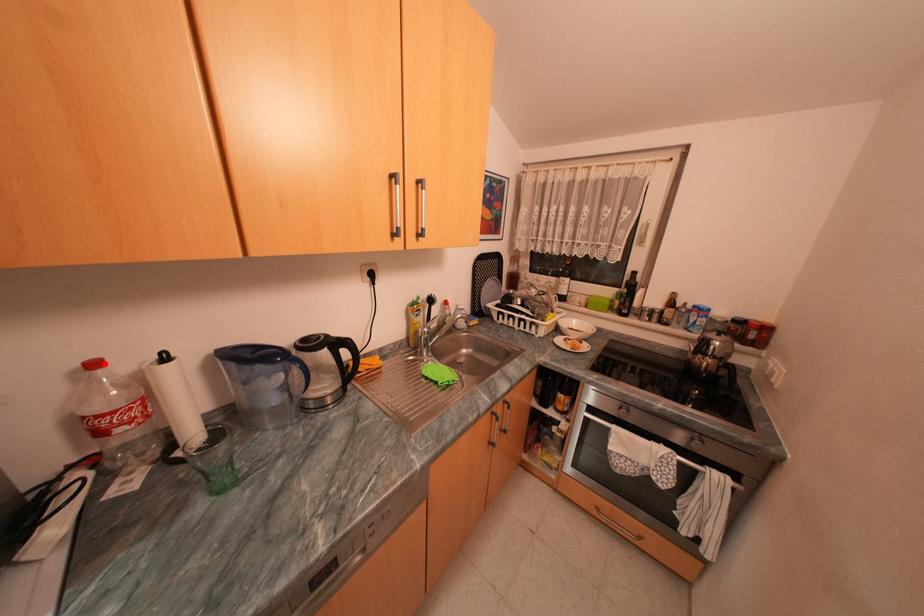
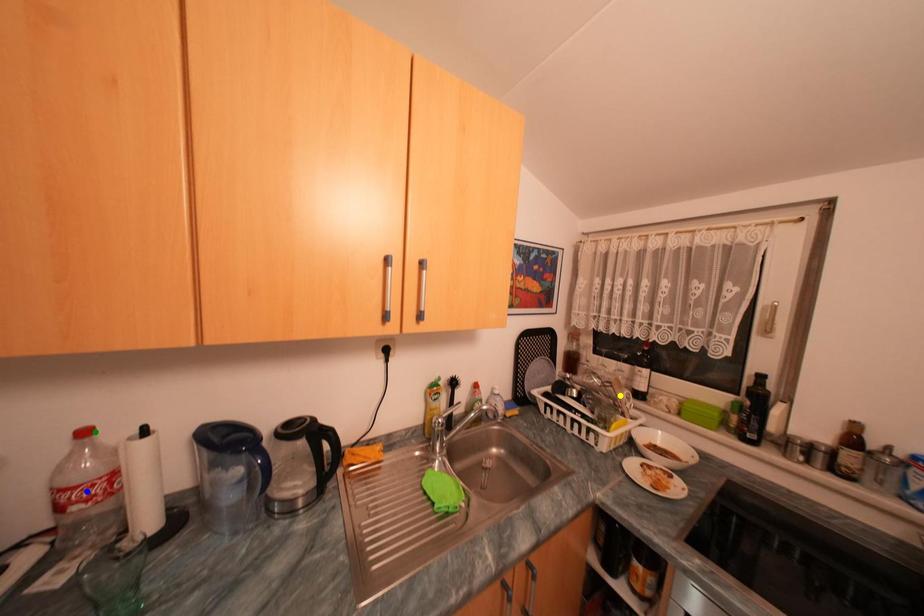
Question: I am providing you with two images of the same scene from different viewpoints. A red point is marked on the first image. You are given multiple points on the second image. Which mark in image 2 goes with the point in image 1?

Choices:
 (A) green point
 (B) blue point
 (C) yellow point

Answer: (A)